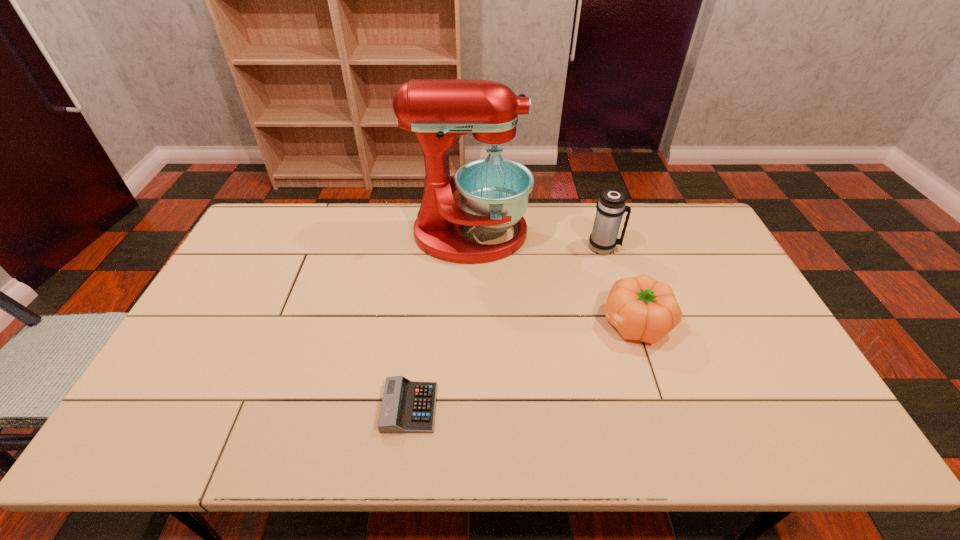
This screenshot has height=540, width=960. Identify the location of the tallest object. (493, 192).

Where is `the second tallest object`? The height and width of the screenshot is (540, 960). the second tallest object is located at coordinates (611, 206).

Where is `the second nearest object`? the second nearest object is located at coordinates (641, 308).

At what (x,y) coordinates should I click in order to perform the action: click on the second shortest object. Please return your answer as a coordinate pair (x, y). Image resolution: width=960 pixels, height=540 pixels. Looking at the image, I should click on (641, 308).

Locate an element on the screen. This screenshot has width=960, height=540. the shortest object is located at coordinates (407, 406).

Where is `calculator`? This screenshot has height=540, width=960. calculator is located at coordinates [407, 406].

At what (x,y) coordinates should I click in order to perform the action: click on free location located 0.210m on the front-facing side of the tallest object. Please return your answer as a coordinate pair (x, y). The image size is (960, 540). Looking at the image, I should click on (589, 234).

Identify the location of vacant space positioned on the side with the handle of the second tallest object. This screenshot has height=540, width=960. (683, 247).

The width and height of the screenshot is (960, 540). I want to click on free spot located on the carved face of the third farthest object, so click(x=487, y=323).

Where is `vacant region located 0.310m on the carved face of the third farthest object`? The width and height of the screenshot is (960, 540). vacant region located 0.310m on the carved face of the third farthest object is located at coordinates (491, 323).